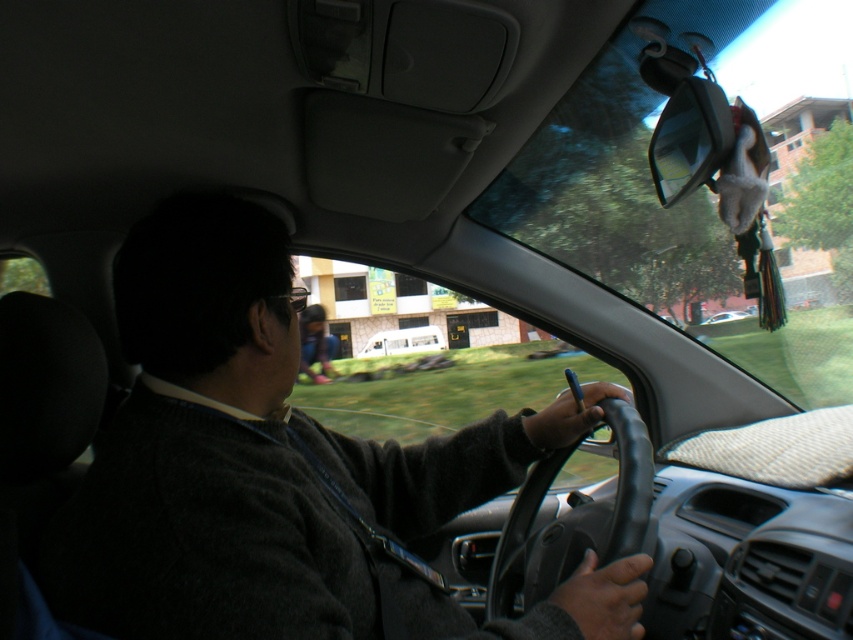
Question: Does dark gray sweater at center appear on the left side of white matte car at center?

Choices:
 (A) no
 (B) yes

Answer: (B)

Question: In this image, where is matte black shirt at center located relative to white matte van at center?

Choices:
 (A) below
 (B) above

Answer: (B)

Question: Which of the following is the farthest from the observer?

Choices:
 (A) black leather steering wheel at center
 (B) white matte car at center
 (C) matte black shirt at center
 (D) white matte van at center

Answer: (D)

Question: Does black leather steering wheel at center have a larger size compared to white matte van at center?

Choices:
 (A) yes
 (B) no

Answer: (B)

Question: Which object appears closest to the camera in this image?

Choices:
 (A) white matte car at center
 (B) dark gray sweater at center
 (C) black leather steering wheel at center

Answer: (B)

Question: Considering the real-world distances, which object is farthest from the matte black shirt at center?

Choices:
 (A) black leather steering wheel at center
 (B) dark gray sweater at center
 (C) white matte car at center
 (D) white matte van at center

Answer: (C)